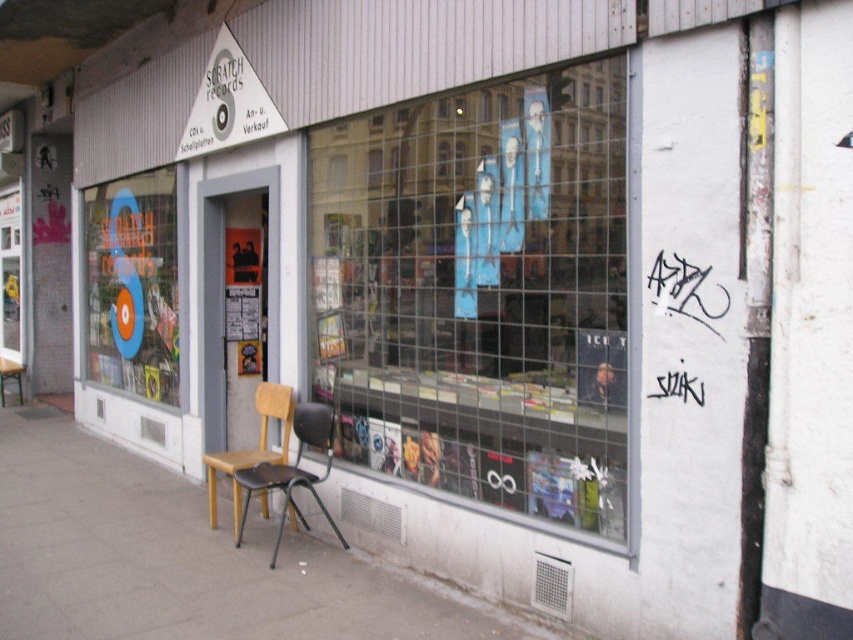
Question: Is black plastic chair at center below wooden seat at center?

Choices:
 (A) yes
 (B) no

Answer: (A)

Question: Which object is closer to the camera taking this photo?

Choices:
 (A) gray concrete pavement at lower left
 (B) wooden seat at center
 (C) black plastic chair at center
 (D) blue glass window at left

Answer: (C)

Question: Can you confirm if gray concrete pavement at lower left is smaller than blue glass window at left?

Choices:
 (A) yes
 (B) no

Answer: (A)

Question: Is blue glass window at left above black plastic chair at center?

Choices:
 (A) yes
 (B) no

Answer: (A)

Question: Which of these objects is positioned farthest from the gray concrete pavement at lower left?

Choices:
 (A) blue glass window at left
 (B) wooden seat at center
 (C) black plastic chair at center

Answer: (A)

Question: Which is nearer to the black plastic chair at center?

Choices:
 (A) wooden seat at center
 (B) gray concrete pavement at lower left

Answer: (A)